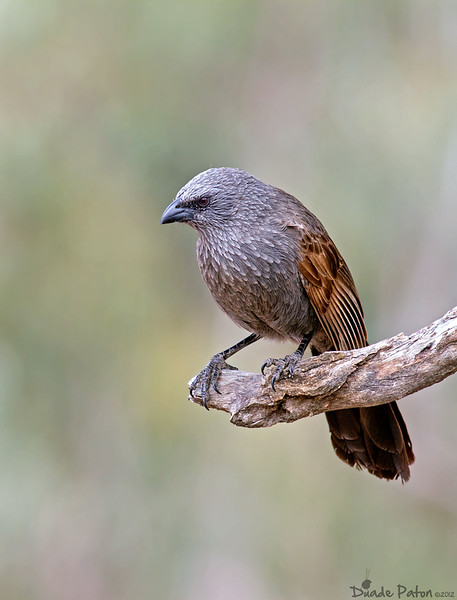
The width and height of the screenshot is (457, 600). Find the location of `chest`. chest is located at coordinates (236, 272).